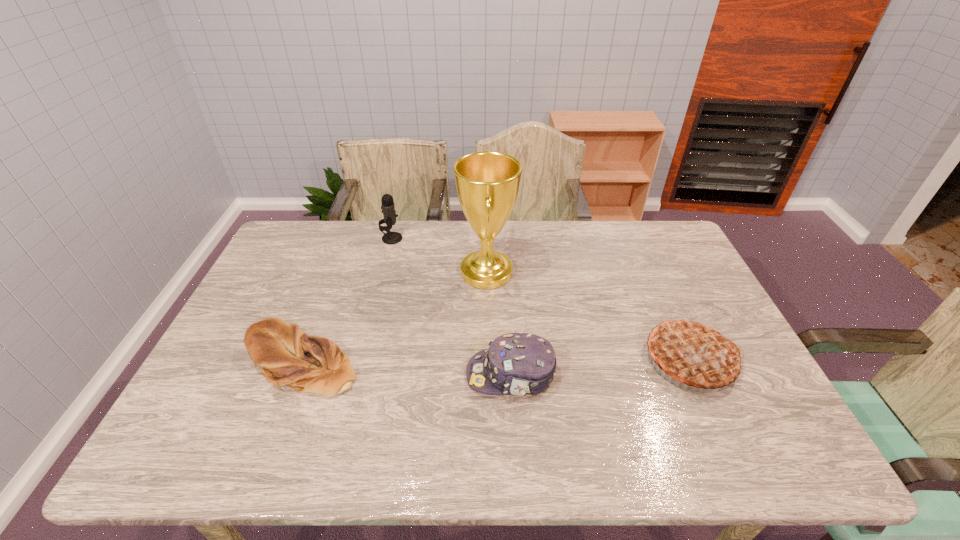
Locate an element on the screen. This screenshot has height=540, width=960. vacant space that is in between the pie and the microphone is located at coordinates (541, 299).

Locate an element on the screen. The height and width of the screenshot is (540, 960). free space between the rightmost object and the award is located at coordinates (588, 316).

Locate an element on the screen. Image resolution: width=960 pixels, height=540 pixels. the fourth closest object to the shortest object is located at coordinates (693, 352).

Identify which object is the closest to the bread. Please provide its 2D coordinates. Your answer should be formatted as a tuple, i.e. [(x, y)], where the tuple contains the x and y coordinates of a point satisfying the conditions above.

[(487, 183)]

This screenshot has height=540, width=960. I want to click on vacant area that satisfies the following two spatial constraints: 1. on the back side of the microphone; 2. on the right side of the shortest object, so click(x=348, y=239).